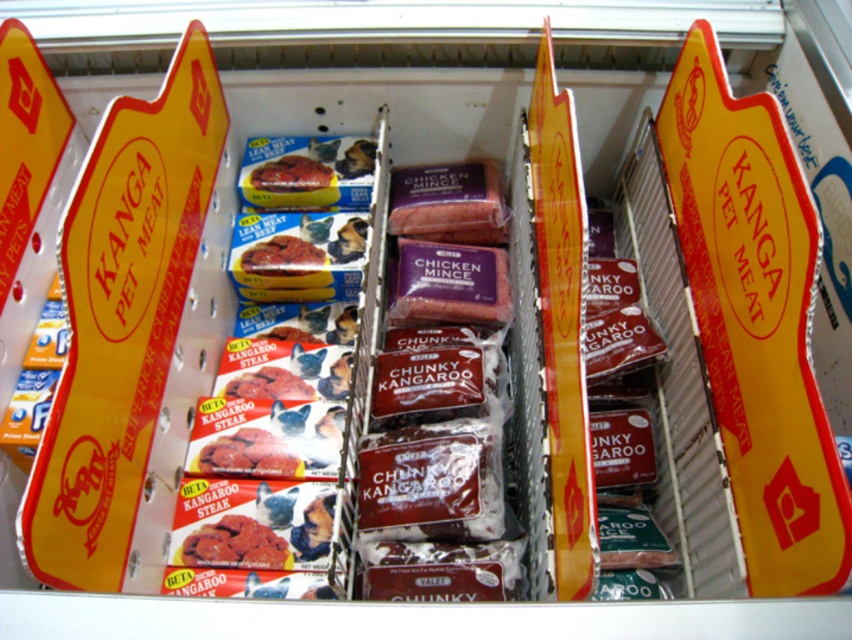
You are a customer looking for the dark red raw meat at center and the matte red pet food at center. Which one can you see more clearly from your current position?

The dark red raw meat at center is in front of the matte red pet food at center, so the dark red raw meat at center is more visible.

You are a customer looking to buy pet food. You see the dark red raw meat at center and the matte red pet food at center on the shelf. Which one is placed lower on the shelf?

The dark red raw meat at center is located below the matte red pet food at center, so it is placed lower on the shelf.